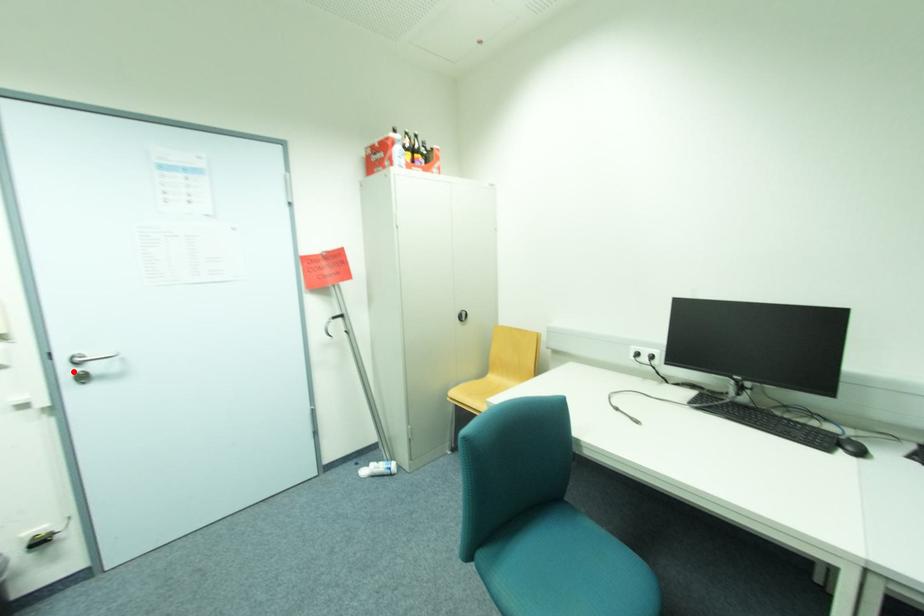
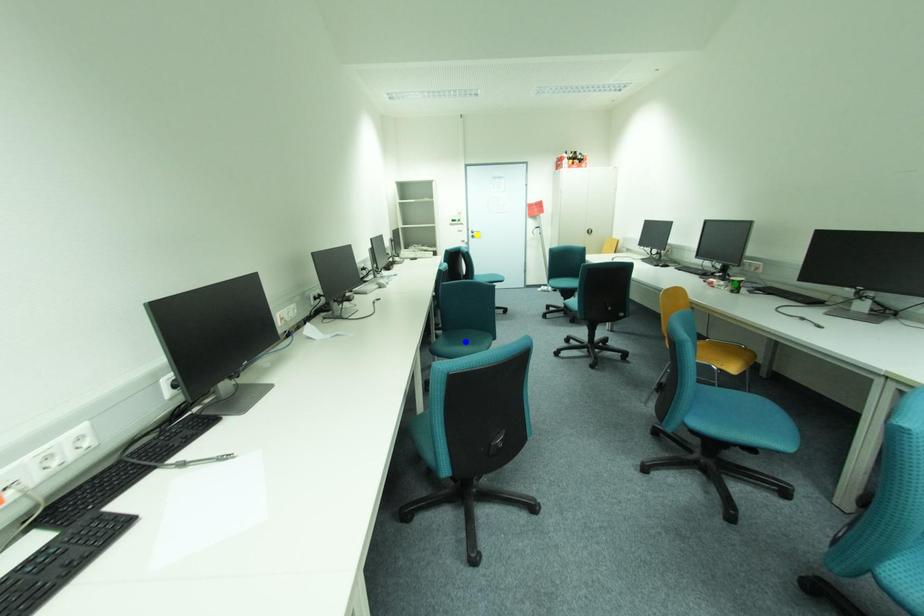
Question: I am providing you with two images of the same scene from different viewpoints. A red point is marked on the first image. You are given multiple points on the second image. Which point in image 2 is actually the same real-world point as the red point in image 1?

Choices:
 (A) yellow point
 (B) blue point
 (C) green point

Answer: (A)